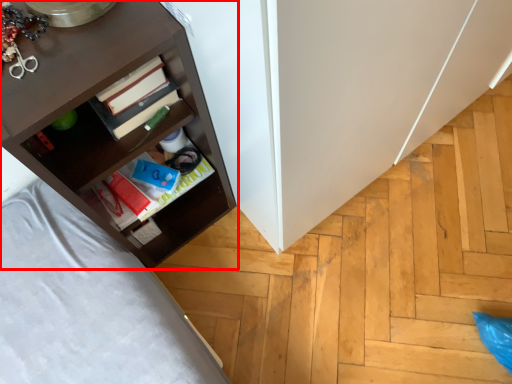
Question: From the image, what is the correct spatial relationship of shelf (annotated by the red box) in relation to book?

Choices:
 (A) right
 (B) left

Answer: (B)